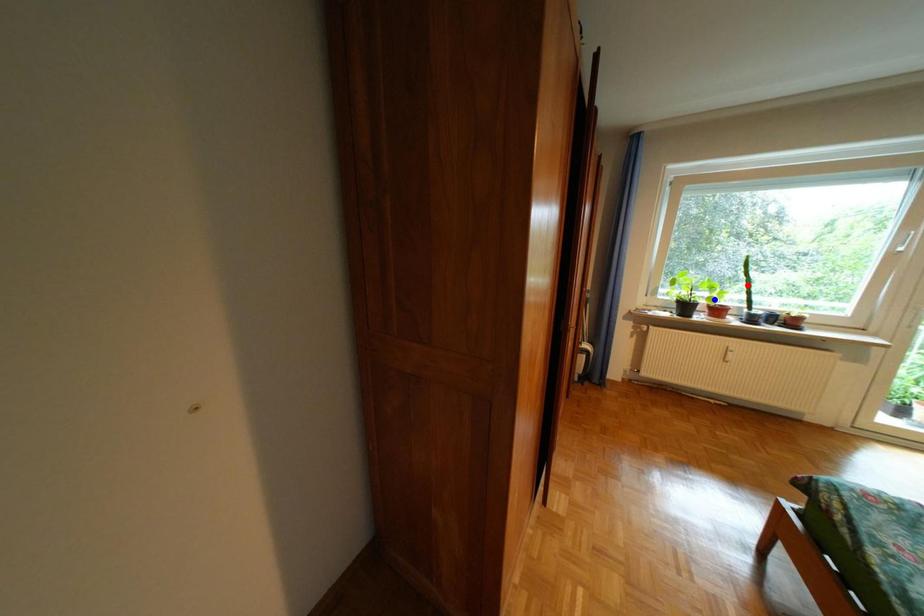
Question: Two points are marked on the image. Which point is closer to the camera?

Choices:
 (A) Blue point is closer.
 (B) Red point is closer.

Answer: (A)